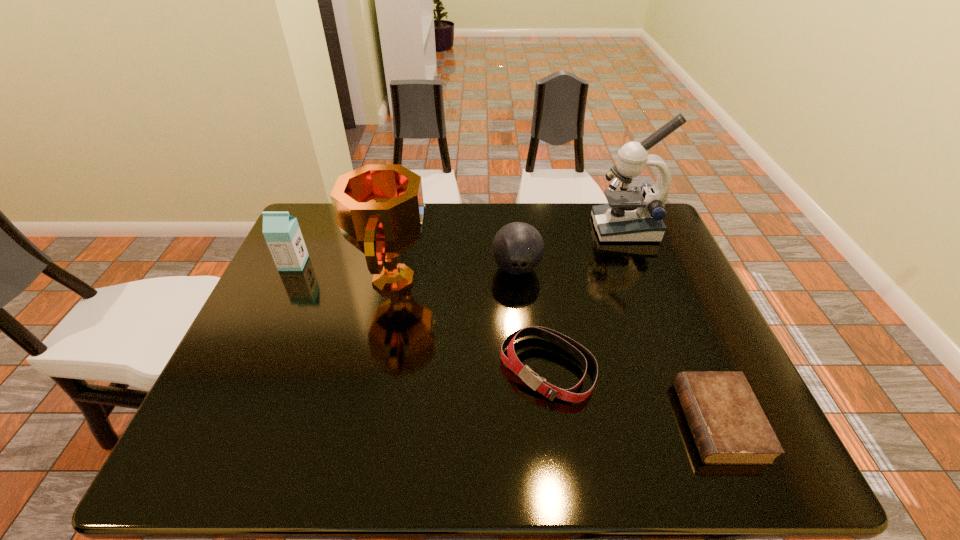
What are the coordinates of `vacant space located 0.370m on the front of the leftmost object` in the screenshot? It's located at (238, 383).

Image resolution: width=960 pixels, height=540 pixels. In order to click on vacant space located on the grip area of the fourth tallest object in this screenshot , I will do `click(527, 383)`.

Find the location of a particular element. Image resolution: width=960 pixels, height=540 pixels. vacant region located 0.230m on the left of the dog collar is located at coordinates (400, 368).

At what (x,y) coordinates should I click in order to perform the action: click on free space located on the spine side of the shortest object. Please return your answer as a coordinate pair (x, y). Looking at the image, I should click on (645, 422).

Find the location of a particular element. This screenshot has height=540, width=960. free space located 0.050m on the spine side of the shortest object is located at coordinates (660, 422).

Find the location of `free spot located on the spine side of the shortest object`. free spot located on the spine side of the shortest object is located at coordinates (523, 422).

You are a GUI agent. You are given a task and a screenshot of the screen. Output one action in this format:
    pyautogui.click(x=<x>, y=<y>)
    Task: Click on the microscope present at the far edge
    
    Given the screenshot: What is the action you would take?
    pyautogui.click(x=632, y=215)

The height and width of the screenshot is (540, 960). I want to click on award present at the far edge, so click(379, 208).

Locate an element on the screen. The image size is (960, 540). object that is at the near edge is located at coordinates (729, 427).

This screenshot has width=960, height=540. Identify the location of object at the left edge. (282, 233).